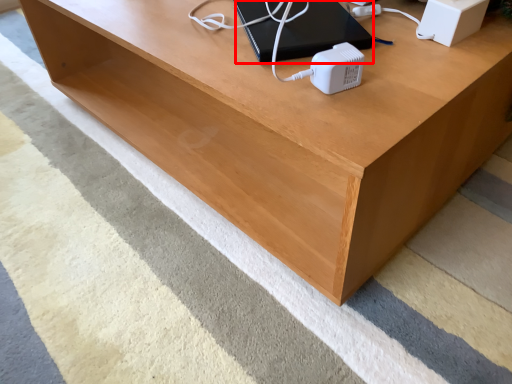
Question: From the image, what is the correct spatial relationship of computer (annotated by the red box) in relation to speaker?

Choices:
 (A) right
 (B) left

Answer: (B)